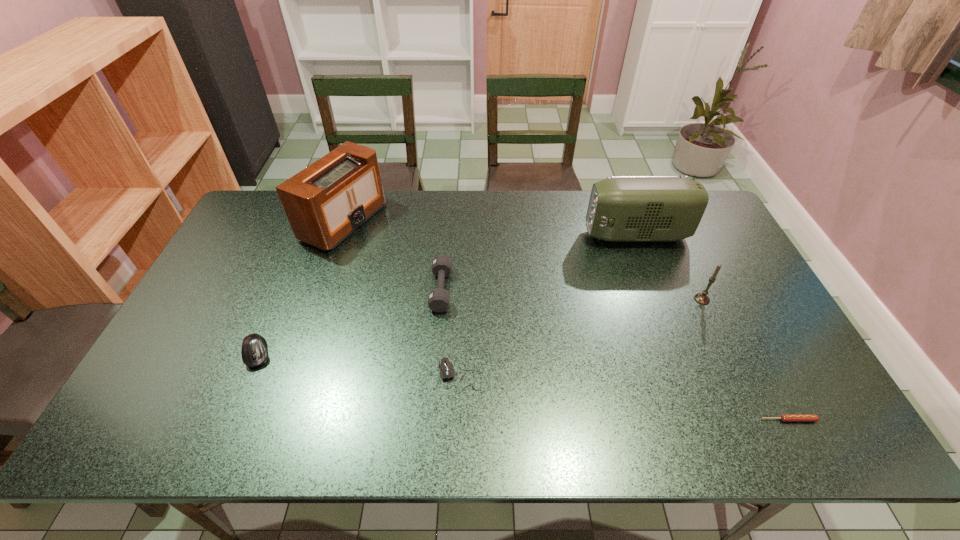
At what (x,y) coordinates should I click in order to perform the action: click on empty location between the sixth tallest object and the candle. Please return your answer as a coordinate pair (x, y). The width and height of the screenshot is (960, 540). Looking at the image, I should click on (581, 338).

The width and height of the screenshot is (960, 540). I want to click on free space that is in between the candle and the left radio_receiver, so [523, 260].

Find the location of a particular element. This screenshot has width=960, height=540. vacant area that lies between the right radio_receiver and the third tallest object is located at coordinates (669, 267).

Identify the location of empty location between the right radio_receiver and the right computer mouse. (548, 306).

Identify the location of vacant space in between the right radio_receiver and the fifth shortest object. (669, 267).

Locate an element on the screen. The image size is (960, 540). free spot between the right radio_receiver and the candle is located at coordinates (669, 267).

The image size is (960, 540). Find the location of `vacant area that lies between the fifth shortest object and the sausage`. vacant area that lies between the fifth shortest object and the sausage is located at coordinates (745, 359).

Identify the location of free area in between the shorter computer mouse and the taller computer mouse. This screenshot has height=540, width=960. (358, 365).

At what (x,y) coordinates should I click in order to perform the action: click on empty space between the fourth shortest object and the left radio_receiver. Please return your answer as a coordinate pair (x, y). This screenshot has width=960, height=540. Looking at the image, I should click on (393, 255).

What are the coordinates of `object that is the fifth nearest to the fifth shortest object` in the screenshot? It's located at (327, 201).